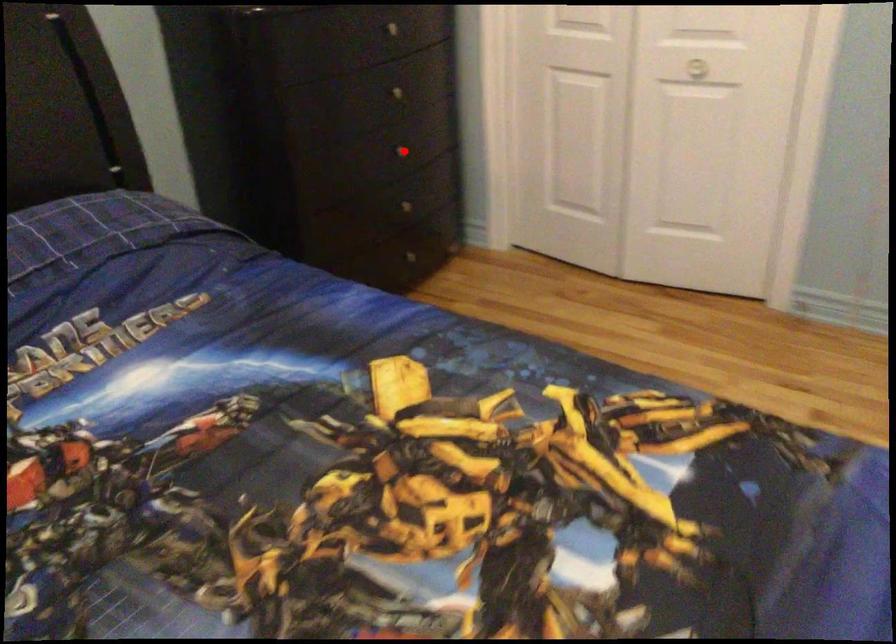
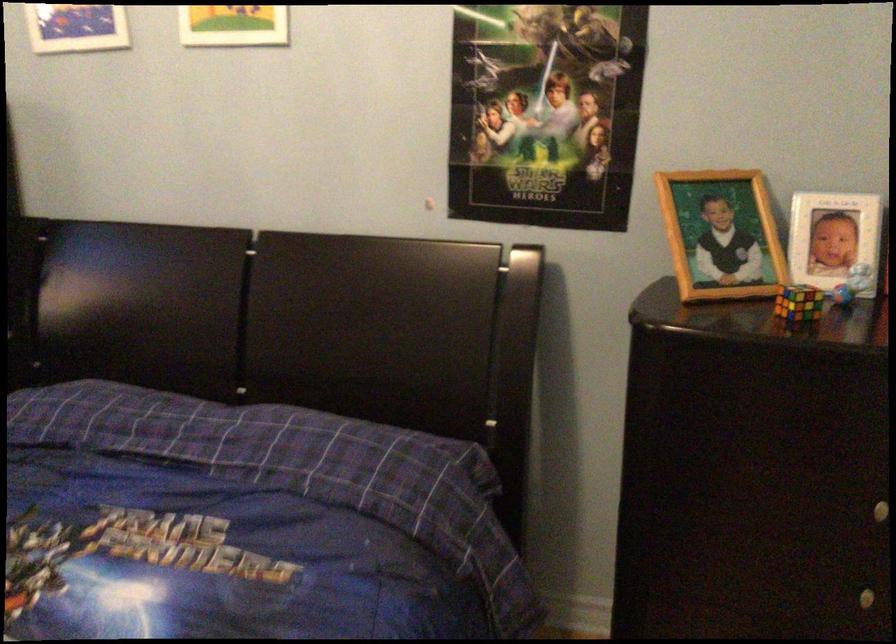
The point at the highlighted location is marked in the first image. Where is the corresponding point in the second image?

(868, 597)